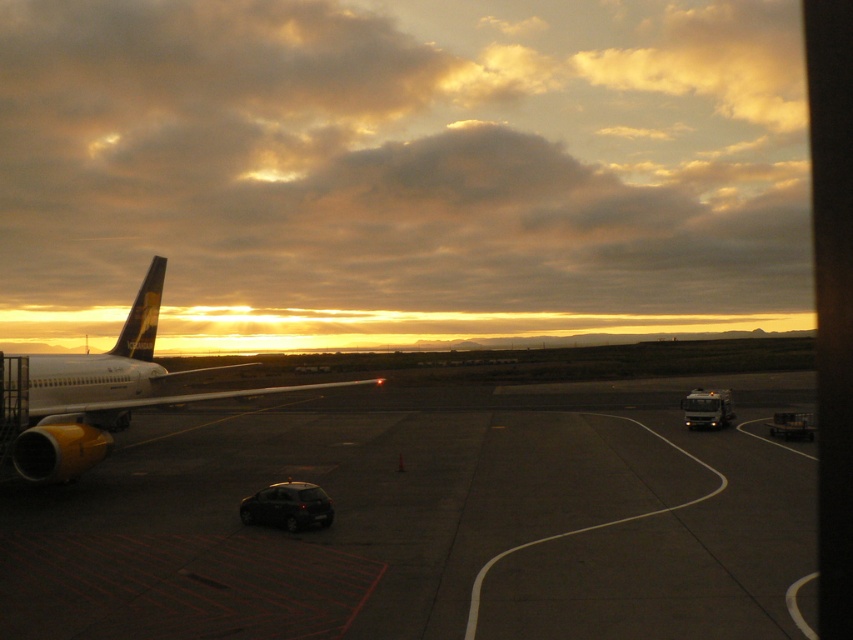
Can you confirm if yellow matte airplane at left is thinner than shiny black car at lower center?

Incorrect, yellow matte airplane at left's width is not less than shiny black car at lower center's.

Is point (131, 310) closer to camera compared to point (323, 493)?

No.

Where is `yellow matte airplane at left`? The height and width of the screenshot is (640, 853). yellow matte airplane at left is located at coordinates (105, 394).

I want to click on yellow matte airplane at left, so click(x=105, y=394).

Measure the distance between yellow matte airplane at left and metallic silver truck at right.

yellow matte airplane at left is 15.52 meters from metallic silver truck at right.

Can you confirm if yellow matte airplane at left is taller than metallic silver truck at right?

Correct, yellow matte airplane at left is much taller as metallic silver truck at right.

Locate an element on the screen. The width and height of the screenshot is (853, 640). yellow matte airplane at left is located at coordinates (105, 394).

Find the location of `yellow matte airplane at left`. yellow matte airplane at left is located at coordinates (105, 394).

Is metallic silver truck at right bigger than metallic silver cart at lower right?

Correct, metallic silver truck at right is larger in size than metallic silver cart at lower right.

Does point (688, 416) come farther from viewer compared to point (790, 433)?

Yes, point (688, 416) is farther from viewer.

Is point (695, 388) closer to camera compared to point (787, 417)?

That is False.

You are a GUI agent. You are given a task and a screenshot of the screen. Output one action in this format:
    pyautogui.click(x=<x>, y=<y>)
    Task: Click on the metallic silver truck at right
    The height and width of the screenshot is (640, 853).
    Given the screenshot: What is the action you would take?
    pyautogui.click(x=706, y=408)